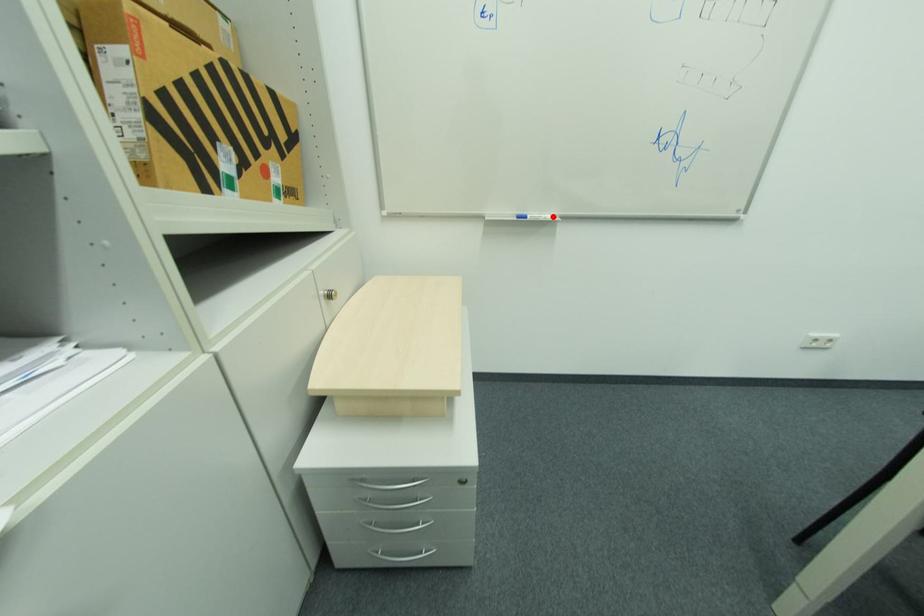
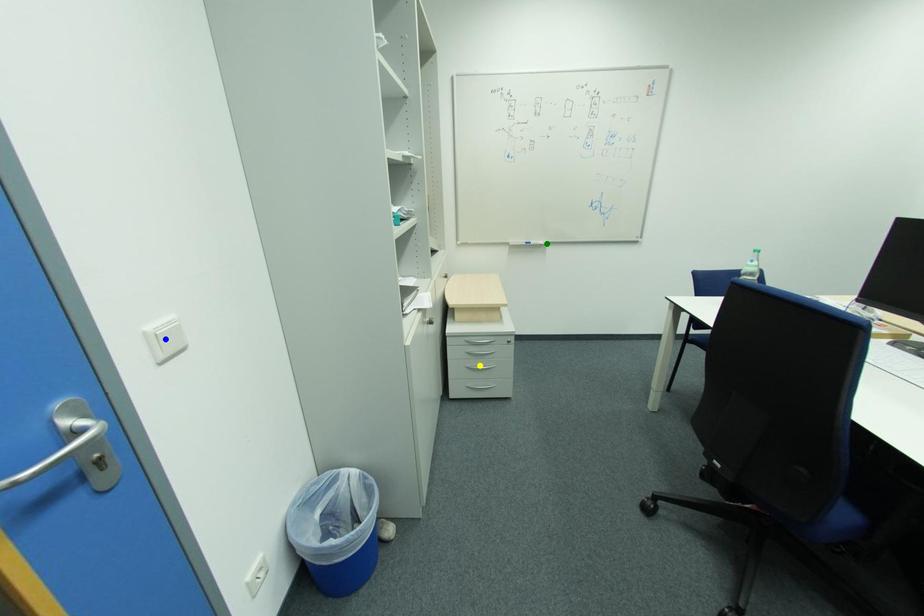
Question: I am providing you with two images of the same scene from different viewpoints. A red point is marked on the first image. You are given multiple points on the second image. Which mark in image 2 goes with the point in image 1?

Choices:
 (A) blue point
 (B) green point
 (C) yellow point

Answer: (B)